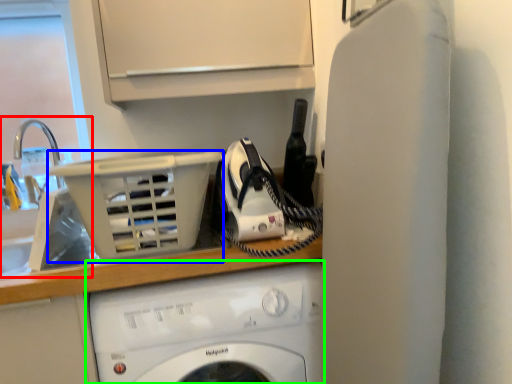
Question: Considering the real-world distances, which object is closest to sink (highlighted by a red box)? basket (highlighted by a blue box) or washing machine (highlighted by a green box).

Choices:
 (A) basket
 (B) washing machine

Answer: (A)